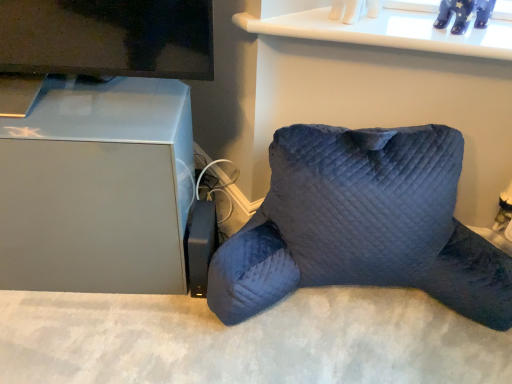
This screenshot has width=512, height=384. What do you see at coordinates (98, 189) in the screenshot?
I see `matte gray cabinet at left` at bounding box center [98, 189].

You are a GUI agent. You are given a task and a screenshot of the screen. Output one action in this format:
    pyautogui.click(x=<x>, y=<y>)
    Task: Click on the matte gray cabinet at left
    
    Given the screenshot: What is the action you would take?
    pyautogui.click(x=98, y=189)

Image resolution: width=512 pixels, height=384 pixels. In order to click on velvet blue pillow at lower right in this screenshot , I will do `click(362, 225)`.

Image resolution: width=512 pixels, height=384 pixels. What do you see at coordinates (362, 225) in the screenshot?
I see `velvet blue pillow at lower right` at bounding box center [362, 225].

Locate an element on the screen. matte gray cabinet at left is located at coordinates (98, 189).

From the picture: Which object is positioned more to the left, velvet blue pillow at lower right or matte gray cabinet at left?

matte gray cabinet at left.

Is velvet blue pillow at lower right positioned behind matte gray cabinet at left?

No, the depth of velvet blue pillow at lower right is less than that of matte gray cabinet at left.

Is point (426, 285) positioned behind point (58, 119)?

Yes, point (426, 285) is behind point (58, 119).

Looking at this image, from the image's perspective, is velvet blue pillow at lower right on top of matte gray cabinet at left?

No, from the image's perspective, velvet blue pillow at lower right is not on top of matte gray cabinet at left.

From a real-world perspective, is velvet blue pillow at lower right beneath matte gray cabinet at left?

Correct, in the physical world, velvet blue pillow at lower right is lower than matte gray cabinet at left.

Considering the relative sizes of velvet blue pillow at lower right and matte gray cabinet at left in the image provided, is velvet blue pillow at lower right thinner than matte gray cabinet at left?

Incorrect, the width of velvet blue pillow at lower right is not less than that of matte gray cabinet at left.

Considering the relative sizes of velvet blue pillow at lower right and matte gray cabinet at left in the image provided, is velvet blue pillow at lower right taller than matte gray cabinet at left?

No.

Looking at the image, does velvet blue pillow at lower right seem bigger or smaller compared to matte gray cabinet at left?

Clearly, velvet blue pillow at lower right is larger in size than matte gray cabinet at left.

Is velvet blue pillow at lower right not inside matte gray cabinet at left?

Yes, velvet blue pillow at lower right is located beyond the bounds of matte gray cabinet at left.

Would you consider velvet blue pillow at lower right to be distant from matte gray cabinet at left?

No, velvet blue pillow at lower right is not far away from matte gray cabinet at left.

Could you tell me if velvet blue pillow at lower right is turned towards matte gray cabinet at left?

No, velvet blue pillow at lower right does not turn towards matte gray cabinet at left.

How many degrees apart are the facing directions of velvet blue pillow at lower right and matte gray cabinet at left?

The facing directions of velvet blue pillow at lower right and matte gray cabinet at left are 2.59 degrees apart.

You are a GUI agent. You are given a task and a screenshot of the screen. Output one action in this format:
    pyautogui.click(x=<x>, y=<y>)
    Task: Click on the furniture behind the velvet blue pillow at lower right
    This screenshot has height=384, width=512.
    Given the screenshot: What is the action you would take?
    pyautogui.click(x=98, y=189)

Looking at this image, is matte gray cabinet at left at the right side of velvet blue pillow at lower right?

In fact, matte gray cabinet at left is to the left of velvet blue pillow at lower right.

Does matte gray cabinet at left lie behind velvet blue pillow at lower right?

Yes, matte gray cabinet at left is further from the viewer.

Does point (190, 113) appear closer or farther from the camera than point (432, 290)?

Clearly, point (190, 113) is more distant from the camera than point (432, 290).

From the image's perspective, which is below, matte gray cabinet at left or velvet blue pillow at lower right?

velvet blue pillow at lower right is shown below in the image.

Looking at this image, from a real-world perspective, is matte gray cabinet at left located higher than velvet blue pillow at lower right?

Indeed, from a real-world perspective, matte gray cabinet at left stands above velvet blue pillow at lower right.

Looking at this image, does matte gray cabinet at left have a lesser width compared to velvet blue pillow at lower right?

Correct, the width of matte gray cabinet at left is less than that of velvet blue pillow at lower right.

Considering the sizes of objects matte gray cabinet at left and velvet blue pillow at lower right in the image provided, who is shorter, matte gray cabinet at left or velvet blue pillow at lower right?

With less height is velvet blue pillow at lower right.

Which of these two, matte gray cabinet at left or velvet blue pillow at lower right, is smaller?

With smaller size is matte gray cabinet at left.

Is matte gray cabinet at left outside of velvet blue pillow at lower right?

matte gray cabinet at left lies outside velvet blue pillow at lower right's area.

Are matte gray cabinet at left and velvet blue pillow at lower right located far from each other?

No, matte gray cabinet at left is not far from velvet blue pillow at lower right.

Does matte gray cabinet at left turn towards velvet blue pillow at lower right?

No, matte gray cabinet at left does not turn towards velvet blue pillow at lower right.

Identify the location of pillow lying on the right of matte gray cabinet at left. (362, 225).

Where is `furniture behind the velvet blue pillow at lower right`? furniture behind the velvet blue pillow at lower right is located at coordinates tap(98, 189).

Find the location of a particular element. Image resolution: width=512 pixels, height=384 pixels. pillow that appears on the right of matte gray cabinet at left is located at coordinates (362, 225).